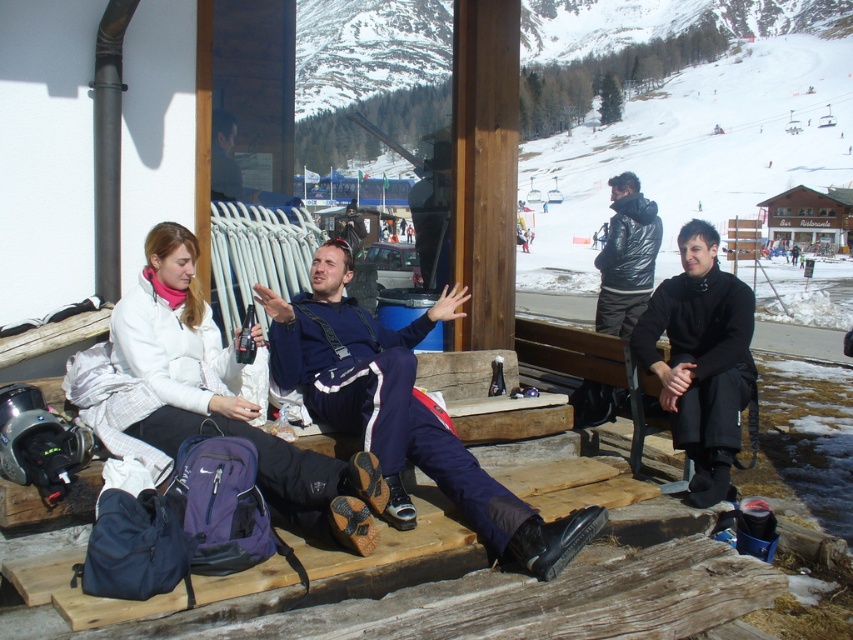
You are a photographer trying to capture a photo of the two people on the deck. You want to ensure the person in the navy blue ski suit at center is on the right side of the person in the white fleece jacket at left in the final image. Based on their current positions, is this arrangement already achieved?

Yes, the navy blue ski suit at center is already positioned on the right side of the white fleece jacket at left, so the desired arrangement is already achieved.

You are a photographer trying to capture a group photo of the two people on the deck. The white fleece jacket at left and the black leather jacket at right are part of the scene. If you want to ensure both jackets are fully visible in the photo, which jacket should you focus on to frame the shot appropriately?

The white fleece jacket at left has a lesser width compared to black leather jacket at right. Therefore, to frame the shot so both jackets are fully visible, you should focus on the black leather jacket at right since it is wider and requires more space in the frame.